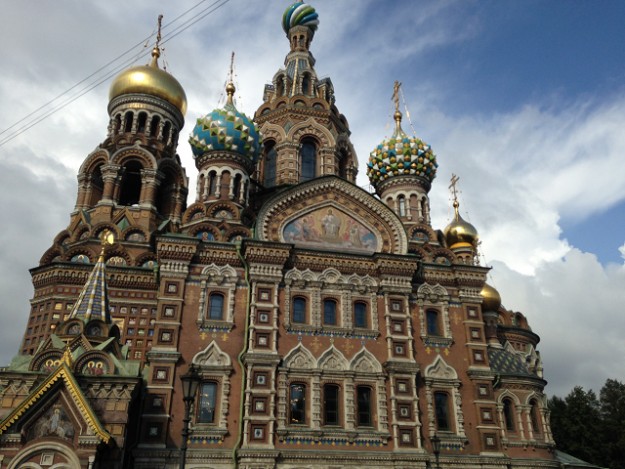
Where is `doors`? The image size is (625, 469). doors is located at coordinates (302, 394), (330, 401), (369, 406).